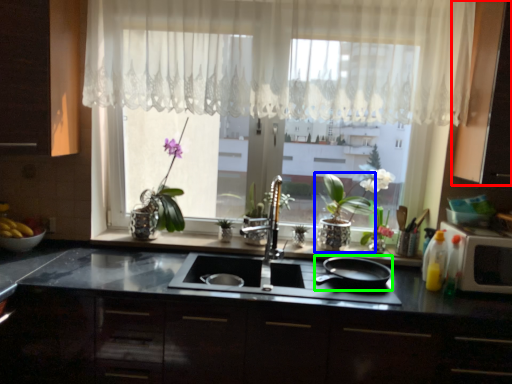
Question: Based on their relative distances, which object is nearer to cabinetry (highlighted by a red box)? Choose from houseplant (highlighted by a blue box) and frying pan (highlighted by a green box).

Choices:
 (A) houseplant
 (B) frying pan

Answer: (A)